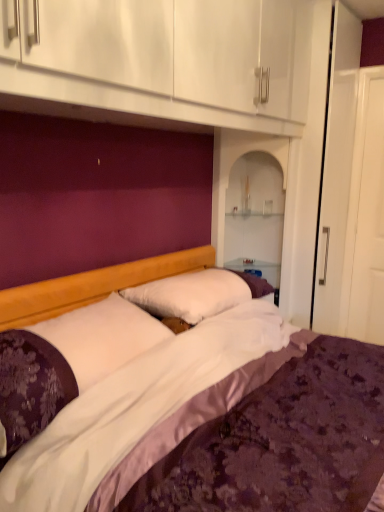
Question: Considering the positions of white soft pillow at center, the 2th pillow when ordered from front to back, and white satin pillow at center, which is counted as the second pillow, starting from the back, in the image, is white soft pillow at center, the 2th pillow when ordered from front to back, taller or shorter than white satin pillow at center, which is counted as the second pillow, starting from the back,?

Choices:
 (A) short
 (B) tall

Answer: (A)

Question: Is point (248, 287) positioned closer to the camera than point (96, 340)?

Choices:
 (A) farther
 (B) closer

Answer: (A)

Question: Considering the relative positions of white soft pillow at center, marked as the first pillow in a back-to-front arrangement, and white satin pillow at center, which is the first pillow from front to back, in the image provided, is white soft pillow at center, marked as the first pillow in a back-to-front arrangement, to the left or to the right of white satin pillow at center, which is the first pillow from front to back,?

Choices:
 (A) left
 (B) right

Answer: (B)

Question: Is white satin pillow at center, which is counted as the second pillow, starting from the back, bigger or smaller than white soft pillow at center, the 2th pillow when ordered from front to back?

Choices:
 (A) small
 (B) big

Answer: (B)

Question: In terms of height, does white satin pillow at center, which is the first pillow from front to back, look taller or shorter compared to white soft pillow at center, the 2th pillow when ordered from front to back?

Choices:
 (A) tall
 (B) short

Answer: (A)

Question: Considering the positions of point (157, 338) and point (165, 288), is point (157, 338) closer or farther from the camera than point (165, 288)?

Choices:
 (A) closer
 (B) farther

Answer: (A)

Question: From the image's perspective, is white satin pillow at center, which is the first pillow from front to back, located above or below white soft pillow at center, the 2th pillow when ordered from front to back?

Choices:
 (A) above
 (B) below

Answer: (B)